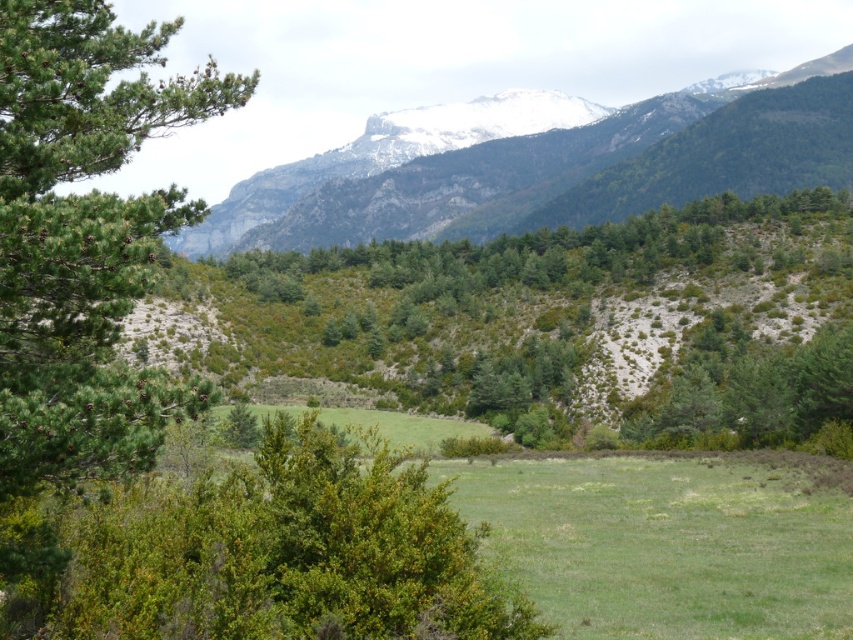
Question: Is green leafy shrub at center above green needle-like at left?

Choices:
 (A) yes
 (B) no

Answer: (B)

Question: Is green needle-like at left smaller than green forested mountain range at upper center?

Choices:
 (A) yes
 (B) no

Answer: (A)

Question: Among these points, which one is nearest to the camera?

Choices:
 (A) (532, 134)
 (B) (231, 586)

Answer: (B)

Question: Which point is closer to the camera taking this photo?

Choices:
 (A) [x=303, y=589]
 (B) [x=33, y=266]
 (C) [x=427, y=132]

Answer: (B)

Question: Is green needle-like at left wider than green forested mountain range at upper center?

Choices:
 (A) no
 (B) yes

Answer: (A)

Question: Among these points, which one is farthest from the camera?

Choices:
 (A) (267, 221)
 (B) (109, 570)
 (C) (18, 81)

Answer: (A)